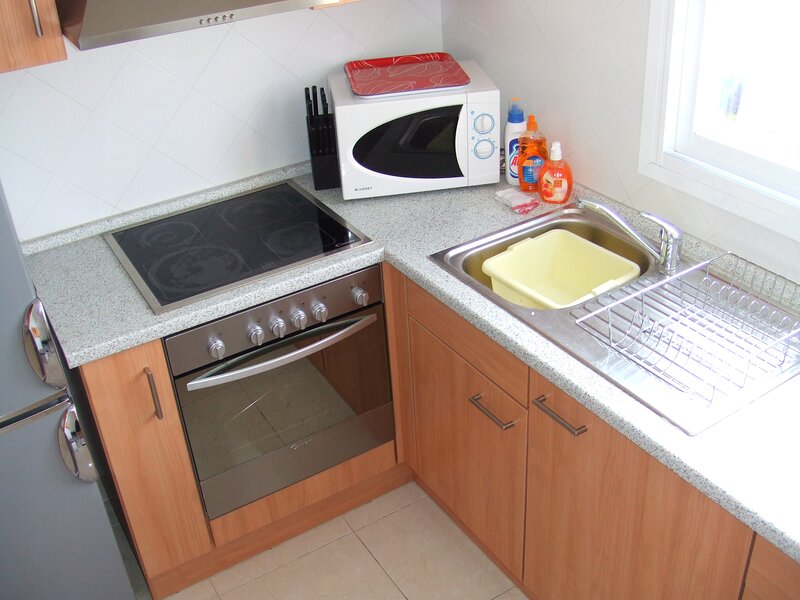
This screenshot has height=600, width=800. Find the location of `oven knob 4`. oven knob 4 is located at coordinates (300, 318).